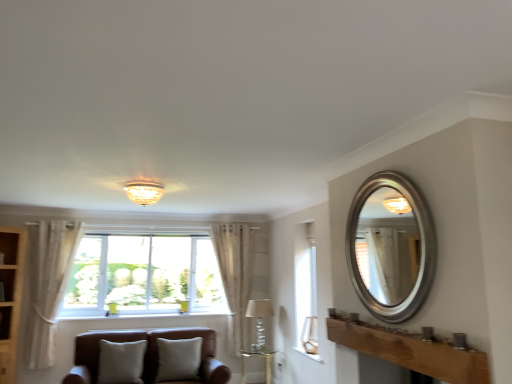
Question: From a real-world perspective, is wooden cabinet at left positioned over sheer fabric curtain at center, which appears as the first curtain when viewed from the back, based on gravity?

Choices:
 (A) yes
 (B) no

Answer: (B)

Question: Is wooden cabinet at left surrounding sheer fabric curtain at center, acting as the second curtain starting from the front?

Choices:
 (A) yes
 (B) no

Answer: (B)

Question: Is wooden cabinet at left positioned beyond the bounds of sheer fabric curtain at center, acting as the second curtain starting from the front?

Choices:
 (A) yes
 (B) no

Answer: (A)

Question: Is wooden cabinet at left oriented away from sheer fabric curtain at center, which appears as the first curtain when viewed from the back?

Choices:
 (A) no
 (B) yes

Answer: (A)

Question: Can you confirm if wooden cabinet at left is shorter than sheer fabric curtain at center, the 2th curtain in the left-to-right sequence?

Choices:
 (A) no
 (B) yes

Answer: (A)

Question: Looking at their shapes, would you say white textured stone at lower center is wider or thinner than matte glass lampshade at upper center, positioned as the 1th lamp in left-to-right order?

Choices:
 (A) thin
 (B) wide

Answer: (A)

Question: Is white textured stone at lower center to the left or to the right of matte glass lampshade at upper center, positioned as the 1th lamp in top-to-bottom order, in the image?

Choices:
 (A) left
 (B) right

Answer: (B)

Question: In terms of size, does white textured stone at lower center appear bigger or smaller than matte glass lampshade at upper center, acting as the 3th lamp starting from the bottom?

Choices:
 (A) small
 (B) big

Answer: (A)

Question: Is point (316, 359) closer or farther from the camera than point (159, 185)?

Choices:
 (A) closer
 (B) farther

Answer: (B)

Question: From the image's perspective, relative to sheer fabric curtain at center, which appears as the first curtain when viewed from the back, is wooden cabinet at left above or below?

Choices:
 (A) above
 (B) below

Answer: (B)

Question: Considering the relative positions of wooden cabinet at left and sheer fabric curtain at center, the 2th curtain in the left-to-right sequence, in the image provided, is wooden cabinet at left to the left or to the right of sheer fabric curtain at center, the 2th curtain in the left-to-right sequence,?

Choices:
 (A) left
 (B) right

Answer: (A)

Question: Is wooden cabinet at left bigger or smaller than sheer fabric curtain at center, which is the 1th curtain from right to left?

Choices:
 (A) big
 (B) small

Answer: (A)

Question: Considering the positions of point (3, 233) and point (232, 253), is point (3, 233) closer or farther from the camera than point (232, 253)?

Choices:
 (A) closer
 (B) farther

Answer: (A)

Question: Is white glass window at center wider or thinner than matte glass lampshade at upper center, positioned as the 1th lamp in left-to-right order?

Choices:
 (A) thin
 (B) wide

Answer: (A)

Question: From the image's perspective, relative to matte glass lampshade at upper center, positioned as the 1th lamp in left-to-right order, is white glass window at center above or below?

Choices:
 (A) above
 (B) below

Answer: (B)